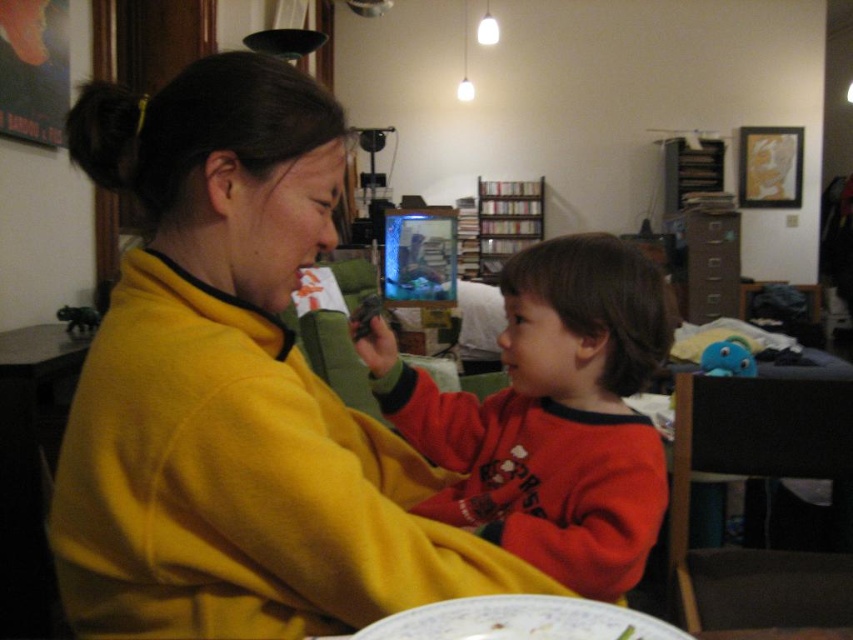
This screenshot has width=853, height=640. What do you see at coordinates (234, 388) in the screenshot? I see `yellow fleece at center` at bounding box center [234, 388].

Which is in front, point (399, 589) or point (389, 628)?

Point (389, 628) is in front.

Locate an element on the screen. This screenshot has width=853, height=640. yellow fleece at center is located at coordinates (234, 388).

Which is in front, point (262, 280) or point (509, 288)?

Point (262, 280)

Which of these two, yellow fleece at center or red fleece sweater at center, stands shorter?

red fleece sweater at center is shorter.

Is point (248, 333) closer to camera compared to point (538, 448)?

Yes, it is.

Image resolution: width=853 pixels, height=640 pixels. I want to click on yellow fleece at center, so click(234, 388).

Between red fleece sweater at center and porcelain plate at lower center, which one has less height?

Standing shorter between the two is porcelain plate at lower center.

The image size is (853, 640). What do you see at coordinates (550, 416) in the screenshot? I see `red fleece sweater at center` at bounding box center [550, 416].

The height and width of the screenshot is (640, 853). I want to click on red fleece sweater at center, so click(x=550, y=416).